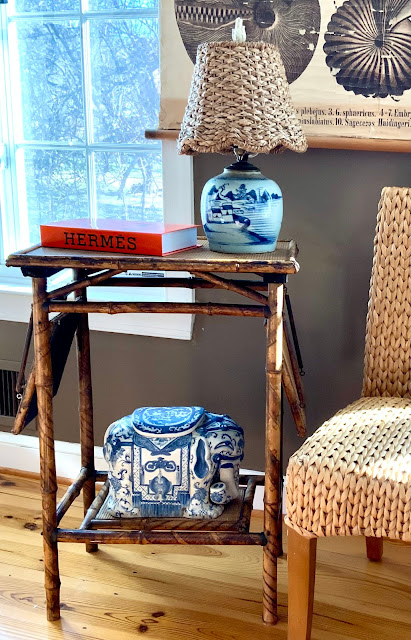
I want to click on table, so click(208, 257).